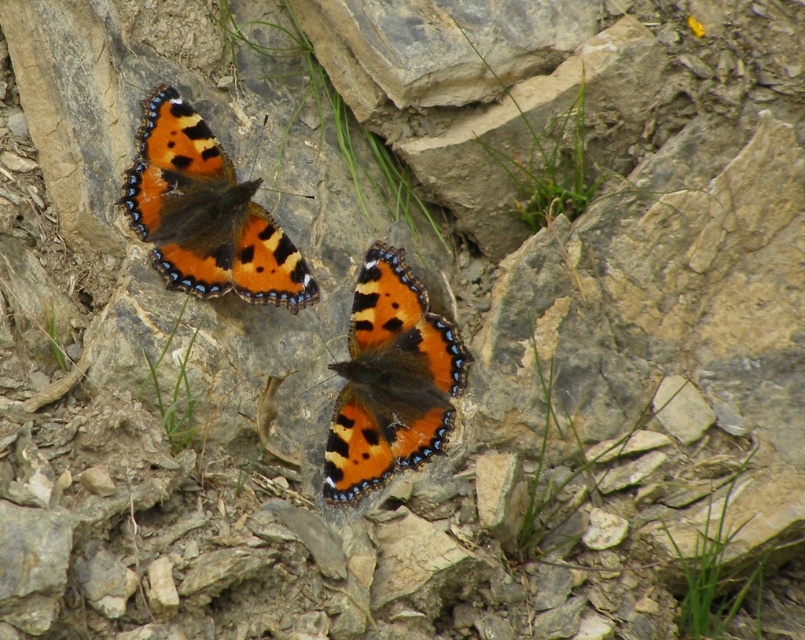
Consider the image. You are holding a camera and want to take a photo of the orange matte butterfly at upper left. If the camera is set to focus at 1.5 meters, will it capture the butterfly in focus?

The orange matte butterfly at upper left and camera are 1.53 meters apart. Since the camera is set to focus at 1.5 meters, the distance is slightly beyond the focus point, so the butterfly may not be in sharp focus.

You are a nature photographer aiming to capture both orange matte butterfly at upper left and orange matte butterfly at center in a single frame. However, the butterfly at the upper left is partially covering the one at the center. Can you adjust your camera angle to ensure both butterflies are fully visible without any overlap?

The orange matte butterfly at upper left is positioned over the orange matte butterfly at center. By adjusting the camera angle slightly downward or to the side, you can shift the perspective to reveal the lower butterfly and reduce the overlap, ensuring both are fully visible.

You are an entomologist observing two orange matte butterflies in a rocky area. You notice the orange matte butterfly at upper left and the orange matte butterfly at center. Which butterfly is located more to the left?

The orange matte butterfly at upper left is more to the left than the orange matte butterfly at center.